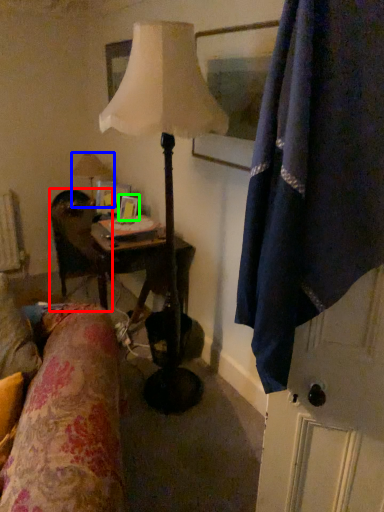
Question: Estimate the real-world distances between objects in this image. Which object is farther from chair (highlighted by a red box), lamp (highlighted by a blue box) or picture frame (highlighted by a green box)?

Choices:
 (A) lamp
 (B) picture frame

Answer: (A)